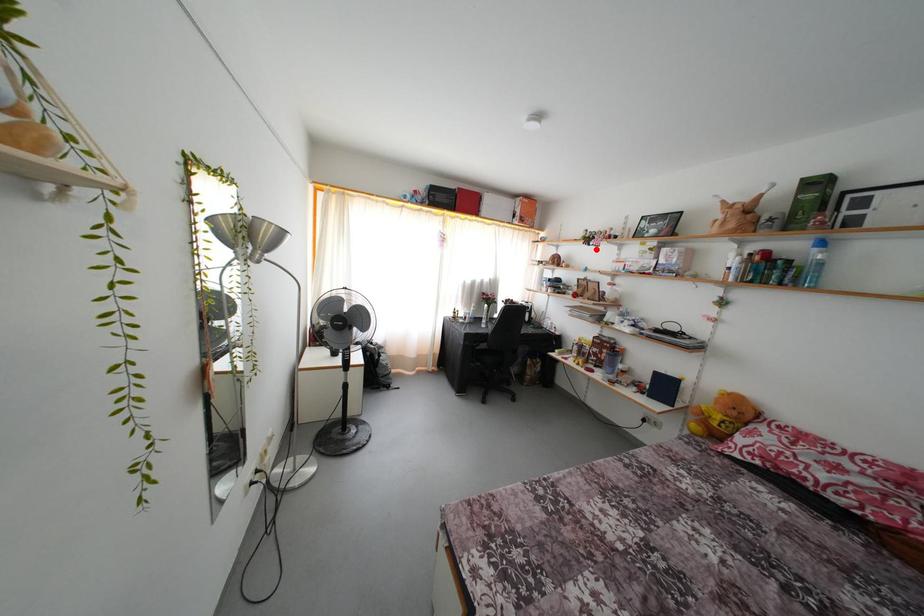
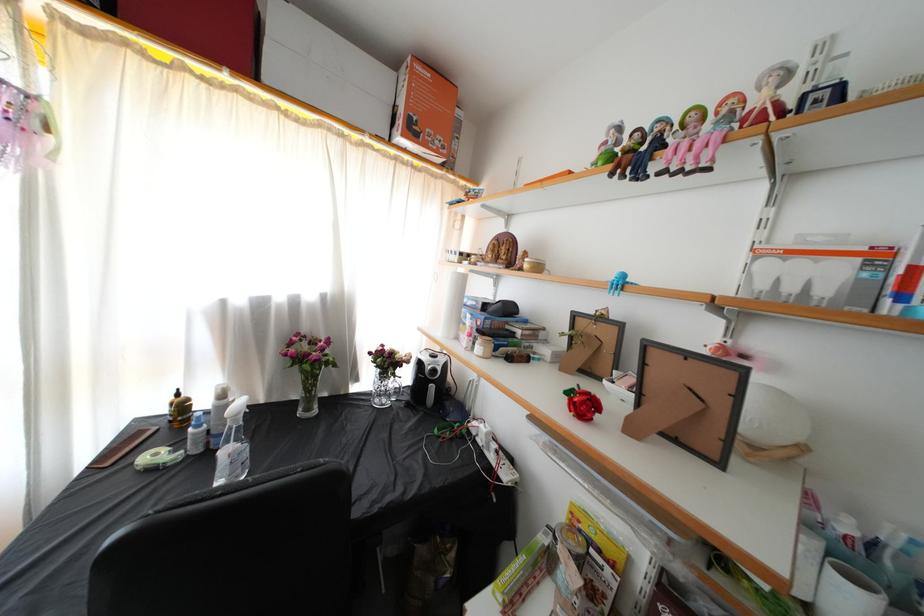
Question: I am providing you with two images of the same scene from different viewpoints. A red point is marked on the first image. Can you still see the location of the red point in image 2?

Choices:
 (A) Yes
 (B) No

Answer: (A)